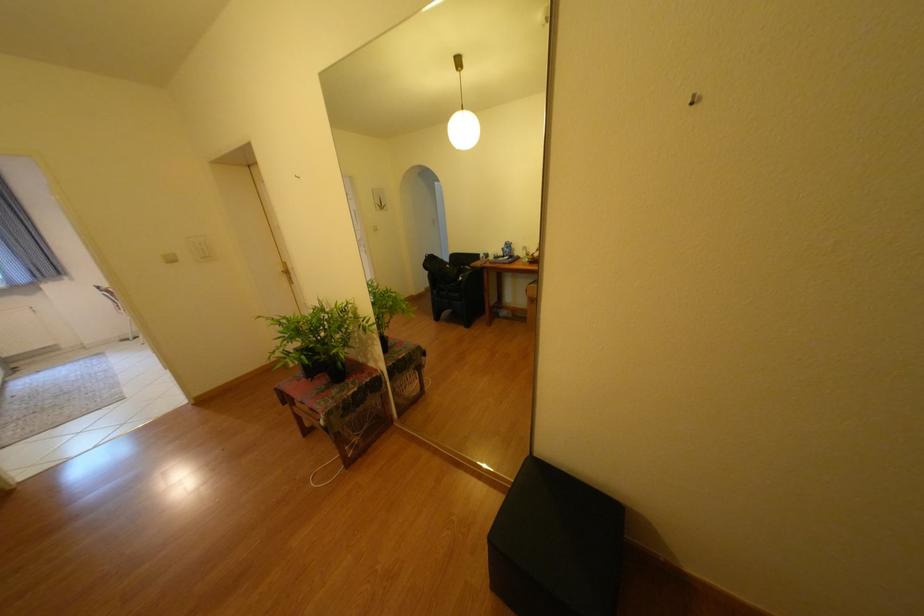
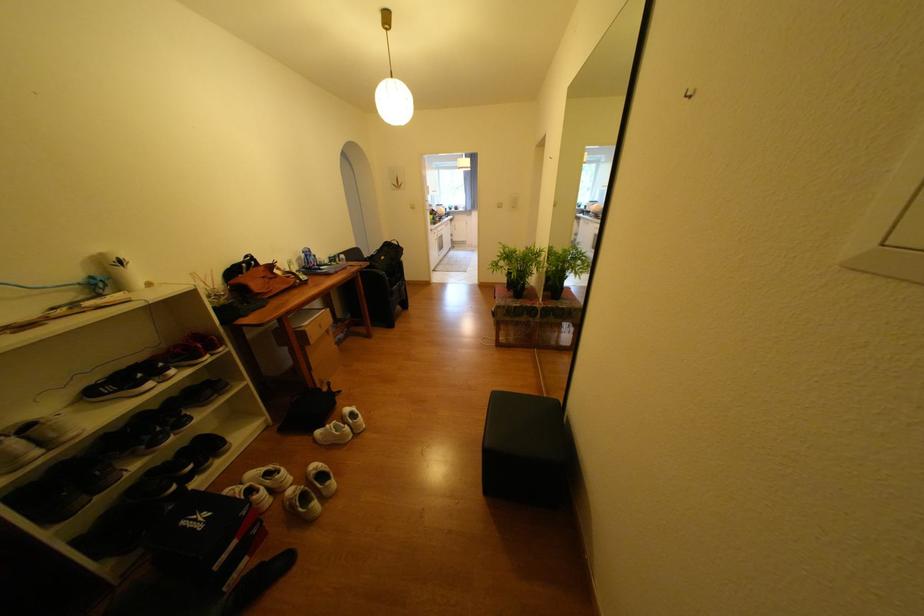
Find the pixel in the second image that matches point (31, 278) in the first image.

(479, 208)